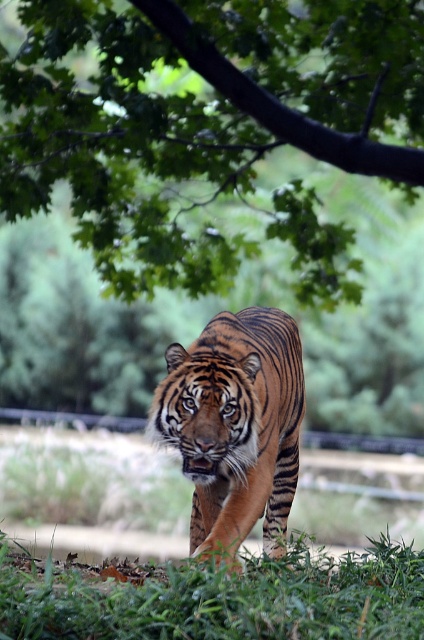
Is the position of green grass at lower center less distant than that of orange-brown striped tiger at center?

Yes, green grass at lower center is in front of orange-brown striped tiger at center.

What do you see at coordinates (215, 596) in the screenshot? This screenshot has width=424, height=640. I see `green grass at lower center` at bounding box center [215, 596].

Locate an element on the screen. The image size is (424, 640). green grass at lower center is located at coordinates (215, 596).

Is point (2, 116) in front of point (384, 625)?

No.

Does green leafy tree at upper center have a greater height compared to green grass at lower center?

Indeed, green leafy tree at upper center has a greater height compared to green grass at lower center.

Which is in front, point (384, 122) or point (111, 605)?

Point (111, 605) is in front.

The width and height of the screenshot is (424, 640). What are the coordinates of `green leafy tree at upper center` in the screenshot? It's located at (198, 116).

Between green leafy tree at upper center and orange-brown striped tiger at center, which one appears on the right side from the viewer's perspective?

From the viewer's perspective, orange-brown striped tiger at center appears more on the right side.

Between green leafy tree at upper center and orange-brown striped tiger at center, which one has more height?

Standing taller between the two is green leafy tree at upper center.

Between point (404, 140) and point (254, 376), which one is positioned in front?

Positioned in front is point (254, 376).

Locate an element on the screen. The image size is (424, 640). green leafy tree at upper center is located at coordinates (198, 116).